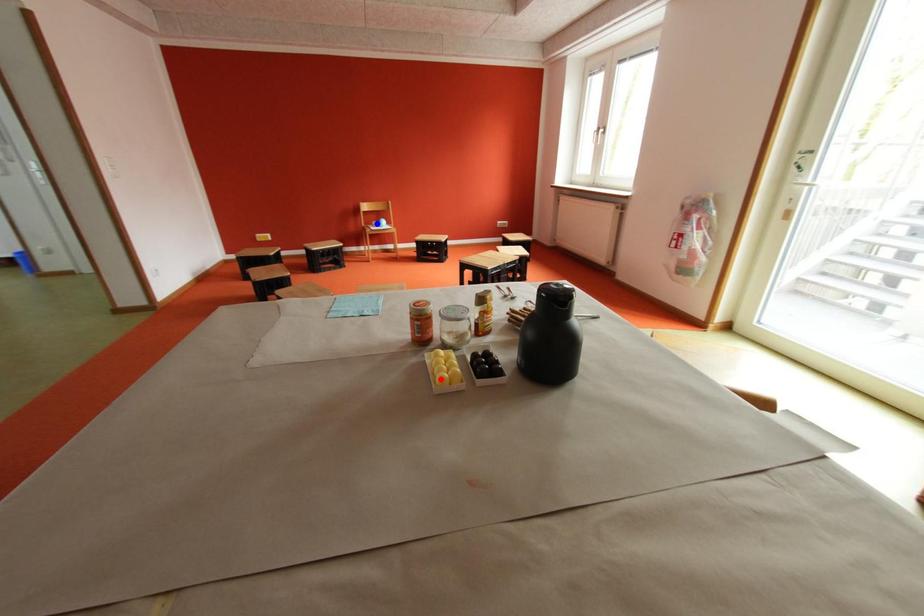
Question: In the image, two points are highlighted. Which point is nearer to the camera? Reply with the corresponding letter.

Choices:
 (A) blue point
 (B) red point

Answer: (B)